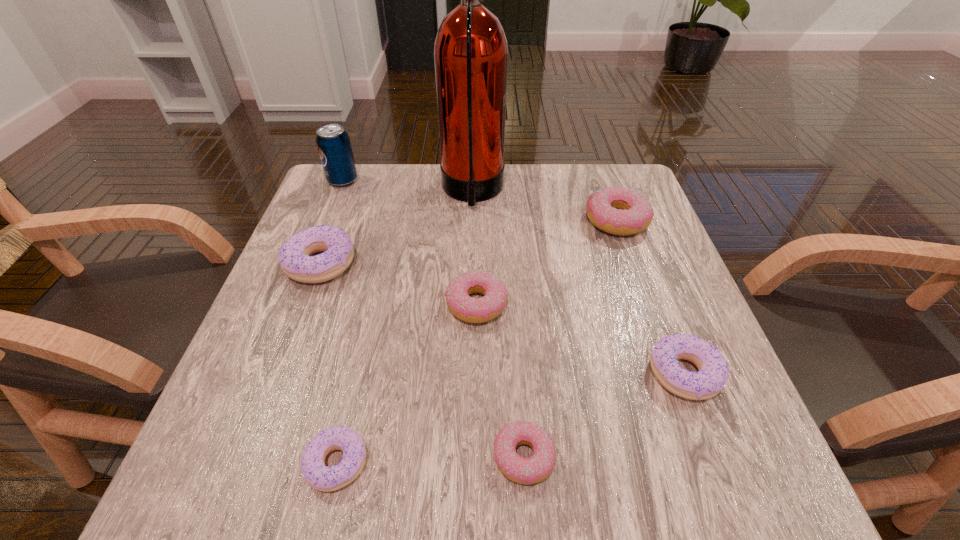
Identify the location of the nearest pink doughnut. The image size is (960, 540). point(538,467).

Where is `the nearest purple doughnut`? The height and width of the screenshot is (540, 960). the nearest purple doughnut is located at coordinates (320, 477).

The height and width of the screenshot is (540, 960). I want to click on the fifth doughnut from right to left, so click(x=320, y=477).

Locate an element on the screen. This screenshot has height=540, width=960. free region located on the front-facing side of the red fire extinguisher is located at coordinates (618, 192).

Locate an element on the screen. vacant space located on the front of the soda can is located at coordinates tap(306, 274).

At what (x,y) coordinates should I click in order to perform the action: click on free space located on the left of the biggest pink doughnut. Please return your answer as a coordinate pair (x, y). The image size is (960, 540). Looking at the image, I should click on (482, 220).

Image resolution: width=960 pixels, height=540 pixels. I want to click on free space located 0.240m on the back of the leftmost purple doughnut, so click(x=351, y=181).

This screenshot has width=960, height=540. Find the location of `free space located on the left of the second nearest pink doughnut`. free space located on the left of the second nearest pink doughnut is located at coordinates (363, 304).

I want to click on free spot located on the left of the rightmost purple doughnut, so click(613, 374).

Find the location of a particular element. The image size is (960, 540). vacant area situated on the back of the smallest pink doughnut is located at coordinates (515, 326).